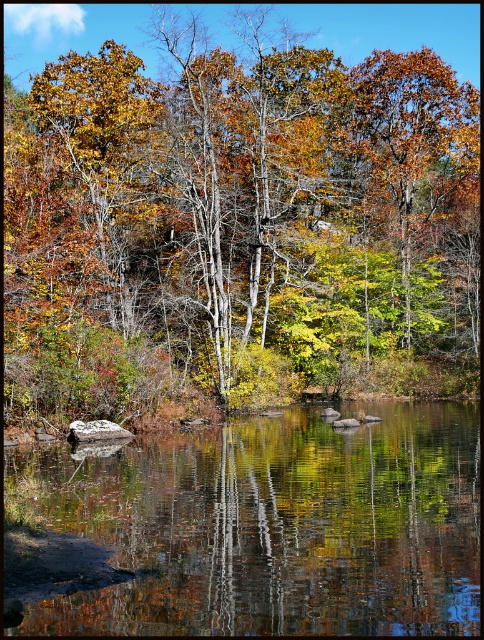
Who is taller, green leafy tree at center or reflective smooth water at center?

Standing taller between the two is green leafy tree at center.

Between point (301, 278) and point (244, 589), which one is positioned in front?

Point (244, 589) is more forward.

The width and height of the screenshot is (484, 640). What are the coordinates of `green leafy tree at center` in the screenshot? It's located at (238, 221).